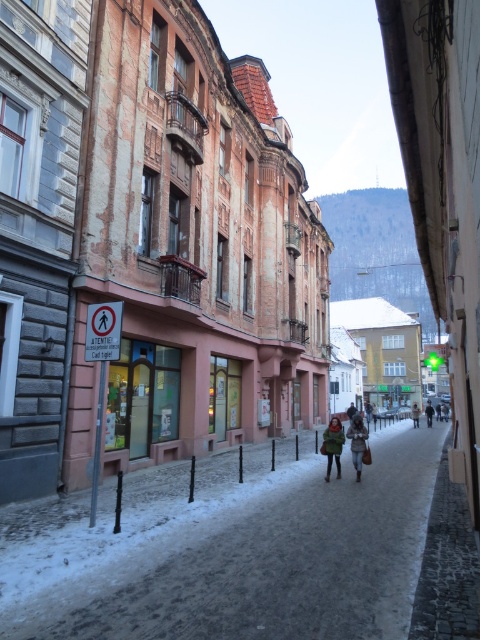
Question: Observing the image, what is the correct spatial positioning of dark brown leather coat at center in reference to dark gray coat at center?

Choices:
 (A) left
 (B) right

Answer: (A)

Question: Estimate the real-world distances between objects in this image. Which object is farther from the snowy cobblestone alley at center?

Choices:
 (A) dark gray coat at center
 (B) green fuzzy coat at center
 (C) white fur coat at center
 (D) dark brown leather coat at center

Answer: (C)

Question: Does snowy cobblestone alley at center appear over dark gray coat at center?

Choices:
 (A) yes
 (B) no

Answer: (A)

Question: Considering the real-world distances, which object is closest to the dark brown leather coat at center?

Choices:
 (A) dark gray coat at center
 (B) snowy cobblestone alley at center

Answer: (B)

Question: Among these objects, which one is farthest from the camera?

Choices:
 (A) white fur coat at center
 (B) dark gray coat at center
 (C) green fuzzy coat at center
 (D) dark brown leather coat at center

Answer: (A)

Question: Does snowy cobblestone alley at center have a larger size compared to dark brown leather coat at center?

Choices:
 (A) yes
 (B) no

Answer: (A)